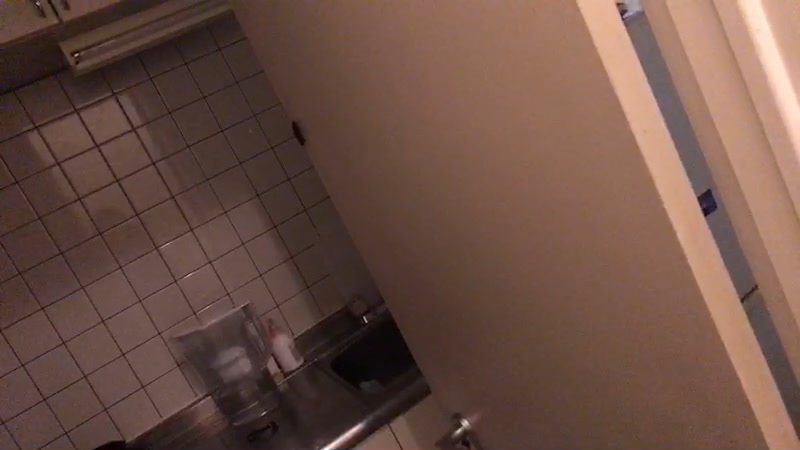
Image resolution: width=800 pixels, height=450 pixels. I want to click on cabinet door, so click(x=22, y=20), click(x=88, y=11).